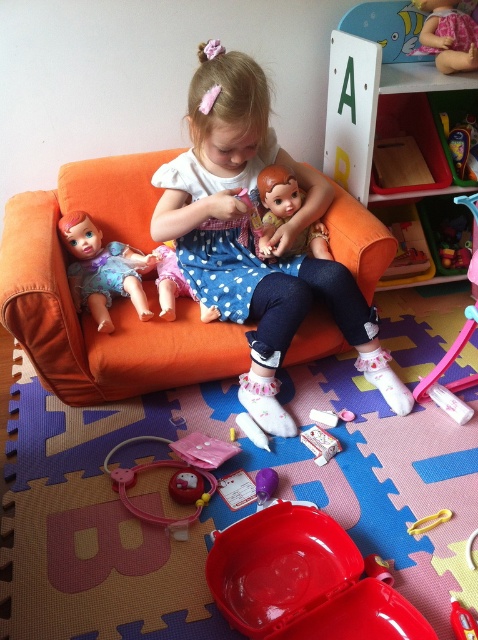
What are the coordinates of the white polka dot dress at center?

The white polka dot dress at center is located at coordinates point [252,240].

You are a toy collector looking for a specific doll. You see the white polka dot dress at center and the matte plastic doll at left in the playroom. Which object is positioned more to the left?

The matte plastic doll at left is positioned more to the left than the white polka dot dress at center.